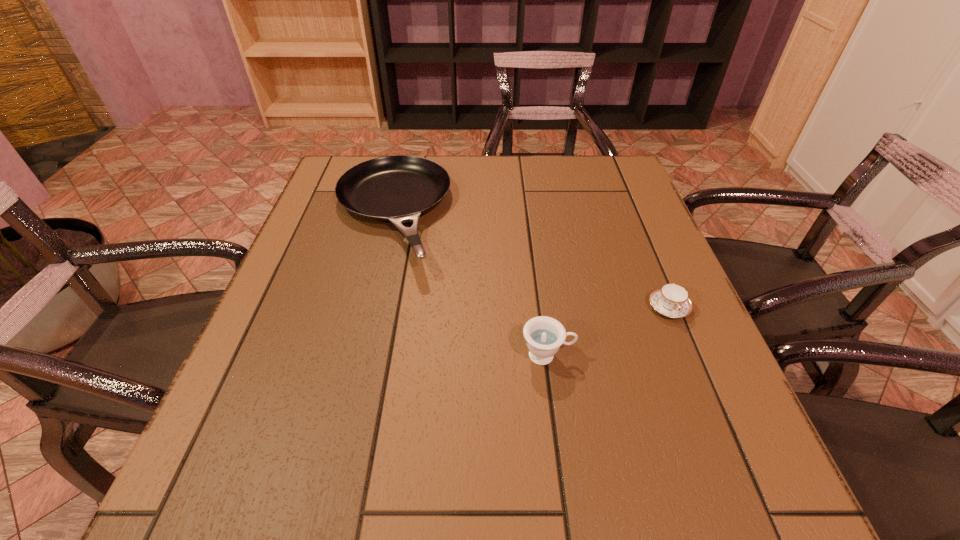
Locate an element on the screen. the closest object to the leftmost object is located at coordinates (544, 335).

This screenshot has width=960, height=540. I want to click on vacant space that satisfies the following two spatial constraints: 1. on the side with the handle of the farther teacup; 2. on the side of the nearer teacup with the handle, so click(x=688, y=355).

You are a GUI agent. You are given a task and a screenshot of the screen. Output one action in this format:
    pyautogui.click(x=<x>, y=<y>)
    Task: Click on the vacant space that satisfies the following two spatial constraints: 1. on the side with the handle of the rightmost object; 2. on the side of the nearer teacup with the handle
    This screenshot has width=960, height=540.
    Given the screenshot: What is the action you would take?
    pyautogui.click(x=688, y=355)